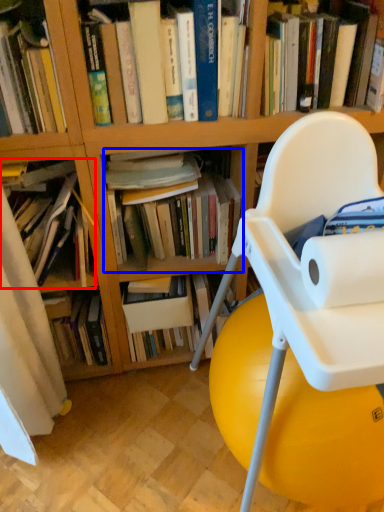
Question: Which point is closer to the camera, book (highlighted by a red box) or book (highlighted by a blue box)?

Choices:
 (A) book
 (B) book

Answer: (A)